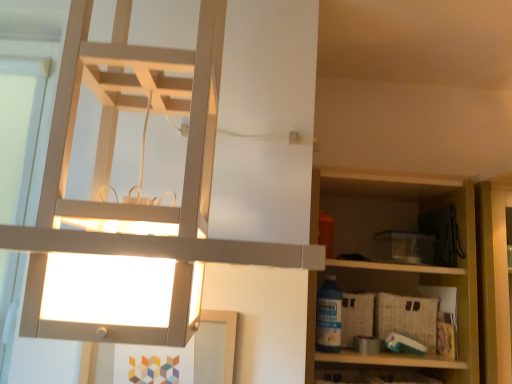
Question: From the image's perspective, is wooden shelf at right located above matte white lamp at upper left?

Choices:
 (A) yes
 (B) no

Answer: (B)

Question: From the image's perspective, does wooden shelf at right appear lower than matte white lamp at upper left?

Choices:
 (A) no
 (B) yes

Answer: (B)

Question: Can you confirm if wooden shelf at right is shorter than matte white lamp at upper left?

Choices:
 (A) yes
 (B) no

Answer: (A)

Question: Is wooden shelf at right bigger than matte white lamp at upper left?

Choices:
 (A) no
 (B) yes

Answer: (A)

Question: Does wooden shelf at right turn towards matte white lamp at upper left?

Choices:
 (A) yes
 (B) no

Answer: (B)

Question: Does wooden shelf at right appear on the right side of matte white lamp at upper left?

Choices:
 (A) no
 (B) yes

Answer: (B)

Question: Is wooden shelf at right positioned in front of woven beige crate at lower right?

Choices:
 (A) no
 (B) yes

Answer: (B)

Question: From a real-world perspective, is wooden shelf at right positioned over woven beige crate at lower right based on gravity?

Choices:
 (A) yes
 (B) no

Answer: (A)

Question: Is wooden shelf at right wider than woven beige crate at lower right?

Choices:
 (A) no
 (B) yes

Answer: (B)

Question: Does wooden shelf at right have a greater height compared to woven beige crate at lower right?

Choices:
 (A) no
 (B) yes

Answer: (B)

Question: Is woven beige crate at lower right at the back of wooden shelf at right?

Choices:
 (A) no
 (B) yes

Answer: (B)

Question: Is wooden shelf at right bigger than woven beige crate at lower right?

Choices:
 (A) no
 (B) yes

Answer: (B)

Question: Is woven beige crate at lower right oriented towards matte white lamp at upper left?

Choices:
 (A) yes
 (B) no

Answer: (B)